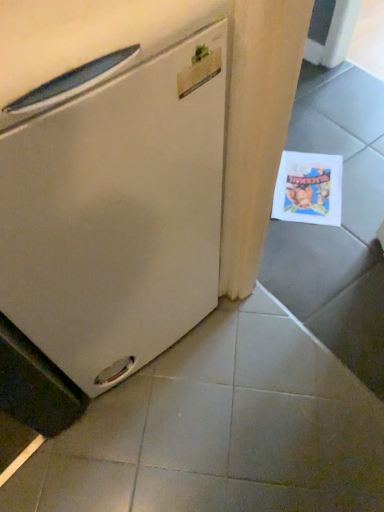
What do you see at coordinates (220, 429) in the screenshot?
I see `gray matte tile at lower center` at bounding box center [220, 429].

What do you see at coordinates (308, 188) in the screenshot?
I see `printed paper postcard at lower right` at bounding box center [308, 188].

I want to click on gray matte tile at lower center, so click(220, 429).

Considering the sizes of white matte refrigerator at left and gray matte tile at lower center in the image, is white matte refrigerator at left bigger or smaller than gray matte tile at lower center?

Clearly, white matte refrigerator at left is larger in size than gray matte tile at lower center.

From a real-world perspective, who is located lower, white matte refrigerator at left or gray matte tile at lower center?

gray matte tile at lower center is physically lower.

Locate an element on the screen. tile below the white matte refrigerator at left (from a real-world perspective) is located at coordinates (220, 429).

Would you say white matte refrigerator at left is part of gray matte tile at lower center's contents?

That's incorrect, white matte refrigerator at left is not inside gray matte tile at lower center.

Considering the points (295, 395) and (80, 254), which point is behind, point (295, 395) or point (80, 254)?

The point (295, 395) is behind.

Is gray matte tile at lower center far from white matte refrigerator at left?

That's not correct — gray matte tile at lower center is a little close to white matte refrigerator at left.

In the image, is gray matte tile at lower center on the left side or the right side of white matte refrigerator at left?

gray matte tile at lower center is positioned on white matte refrigerator at left's right side.

Would you say printed paper postcard at lower right is inside or outside white matte refrigerator at left?

printed paper postcard at lower right is spatially situated outside white matte refrigerator at left.

Is printed paper postcard at lower right further to the viewer compared to white matte refrigerator at left?

Yes, the depth of printed paper postcard at lower right is greater than that of white matte refrigerator at left.

Which is more to the left, printed paper postcard at lower right or white matte refrigerator at left?

From the viewer's perspective, white matte refrigerator at left appears more on the left side.

From a real-world perspective, is printed paper postcard at lower right located higher than gray matte tile at lower center?

Yes.

Between printed paper postcard at lower right and gray matte tile at lower center, which one has larger size?

gray matte tile at lower center.

Considering the relative positions of printed paper postcard at lower right and gray matte tile at lower center in the image provided, is printed paper postcard at lower right to the left or to the right of gray matte tile at lower center?

Clearly, printed paper postcard at lower right is on the right of gray matte tile at lower center in the image.

Find the location of a particular element. postcard above the gray matte tile at lower center (from the image's perspective) is located at coordinates (x=308, y=188).

From the picture: From a real-world perspective, which is physically below, white matte refrigerator at left or printed paper postcard at lower right?

In real-world perspective, printed paper postcard at lower right is lower.

Is the depth of white matte refrigerator at left greater than that of printed paper postcard at lower right?

No, it is in front of printed paper postcard at lower right.

Choose the correct answer: Is white matte refrigerator at left inside printed paper postcard at lower right or outside it?

white matte refrigerator at left is located beyond the bounds of printed paper postcard at lower right.

Is white matte refrigerator at left aimed at printed paper postcard at lower right?

No, white matte refrigerator at left does not turn towards printed paper postcard at lower right.

Would you say gray matte tile at lower center is a long distance from printed paper postcard at lower right?

No, gray matte tile at lower center is in close proximity to printed paper postcard at lower right.

This screenshot has height=512, width=384. What are the coordinates of `postcard that is above the gray matte tile at lower center (from a real-world perspective)` in the screenshot? It's located at (308, 188).

Can you tell me how much gray matte tile at lower center and printed paper postcard at lower right differ in facing direction?

139 degrees.

Where is `refrigerator in front of the gray matte tile at lower center`? Image resolution: width=384 pixels, height=512 pixels. refrigerator in front of the gray matte tile at lower center is located at coordinates (118, 196).

Locate an element on the screen. tile below the white matte refrigerator at left (from the image's perspective) is located at coordinates (220, 429).

Considering their positions, is gray matte tile at lower center positioned further to white matte refrigerator at left than printed paper postcard at lower right?

Based on the image, printed paper postcard at lower right appears to be further to white matte refrigerator at left.

From the image, which object appears to be farther from printed paper postcard at lower right, gray matte tile at lower center or white matte refrigerator at left?

white matte refrigerator at left is positioned further to the anchor printed paper postcard at lower right.

When comparing their distances from gray matte tile at lower center, does printed paper postcard at lower right or white matte refrigerator at left seem further?

printed paper postcard at lower right lies further to gray matte tile at lower center than the other object.

Considering their positions, is white matte refrigerator at left positioned further to gray matte tile at lower center than printed paper postcard at lower right?

printed paper postcard at lower right is positioned further to the anchor gray matte tile at lower center.

Which object lies further to the anchor point printed paper postcard at lower right, white matte refrigerator at left or gray matte tile at lower center?

The object further to printed paper postcard at lower right is white matte refrigerator at left.

In the scene shown: Considering their positions, is printed paper postcard at lower right positioned further to white matte refrigerator at left than gray matte tile at lower center?

printed paper postcard at lower right.

Where is `tile between white matte refrigerator at left and printed paper postcard at lower right from front to back`? This screenshot has width=384, height=512. tile between white matte refrigerator at left and printed paper postcard at lower right from front to back is located at coordinates (220, 429).